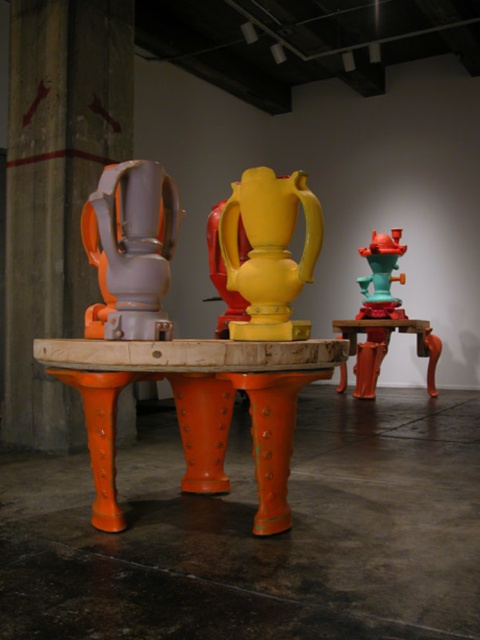
In the scene shown: You are an art curator planning to move a large sculpture from the orange metallic table at center to the matte orange table at center. Which table is positioned to the right side of the other? Please specify both tables in your answer.

The orange metallic table at center is to the left of the matte orange table at center, so the matte orange table at center is positioned to the right side of the orange metallic table at center.